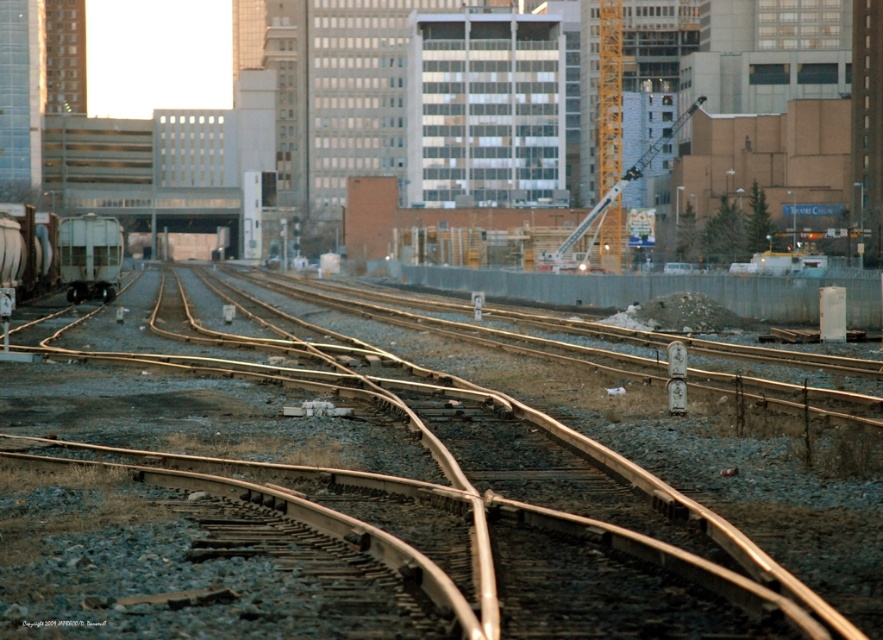
You are a railway inspector checking the alignment of the metallic brown tracks at center and the gray matte train car at left. Based on their positions, can you determine if the train car is properly placed on the tracks?

The metallic brown tracks at center are positioned under the gray matte train car at left, indicating that the train car is properly placed on the tracks.